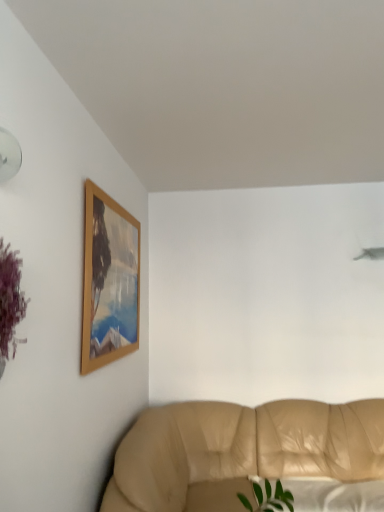
You are a GUI agent. You are given a task and a screenshot of the screen. Output one action in this format:
    pyautogui.click(x=<x>, y=<y>)
    Task: Click on the beige leather couch at lower right
    The width and height of the screenshot is (384, 512).
    Given the screenshot: What is the action you would take?
    pos(240,451)

Image resolution: width=384 pixels, height=512 pixels. What do you see at coordinates (240, 451) in the screenshot? I see `beige leather couch at lower right` at bounding box center [240, 451].

The width and height of the screenshot is (384, 512). Identify the location of beige leather couch at lower right. (240, 451).